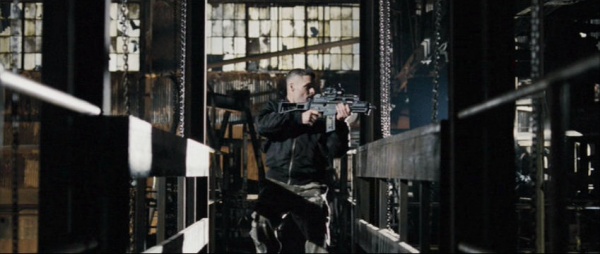
Where is `wood railing`? The image size is (600, 254). wood railing is located at coordinates (408, 150), (197, 159), (193, 239), (391, 248).